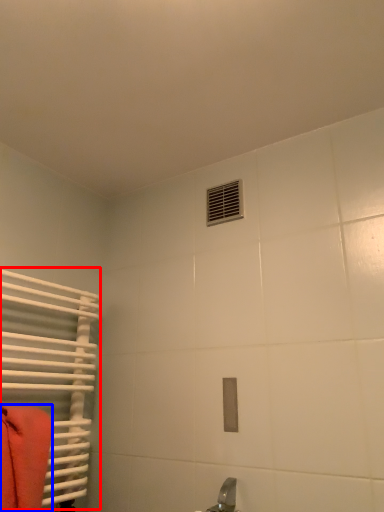
Question: Which of the following is the farthest to the observer, radiator (highlighted by a red box) or towel (highlighted by a blue box)?

Choices:
 (A) radiator
 (B) towel

Answer: (A)